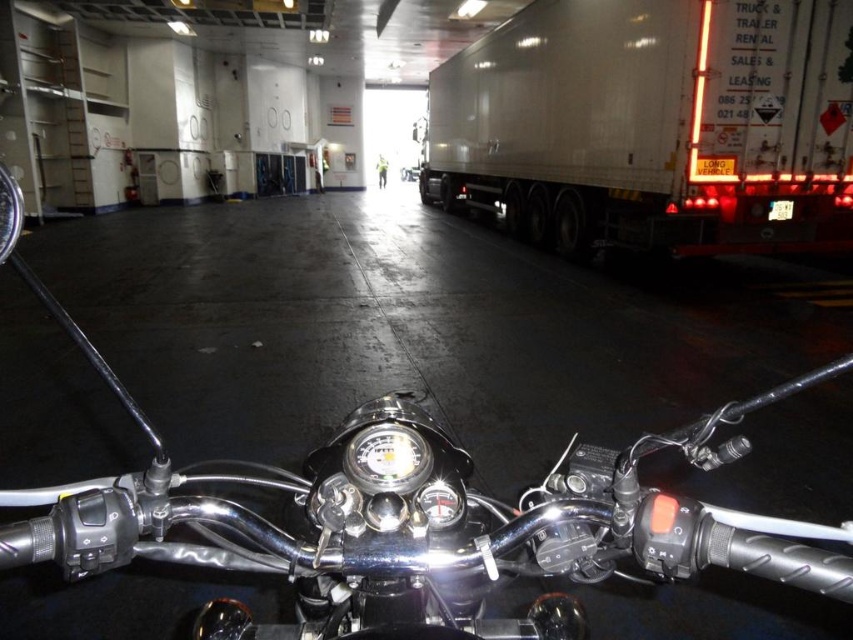
You are riding a motorcycle in a large warehouse and need to check if there is enough space to turn around. The motorcycle has two parts you can see clearly from your position. Which part, the polished chrome motorcycle at center or the metallic silver headlight at center, takes up more space visually?

The polished chrome motorcycle at center is larger in size than the metallic silver headlight at center, so the polished chrome motorcycle at center takes up more space visually.

You are riding a motorcycle and want to park it in a spot that can accommodate both the white glossy trailer truck at right and the metallic silver headlight at center. Given their sizes, which one requires more space for parking?

The white glossy trailer truck at right requires more space for parking since it has a larger size compared to the metallic silver headlight at center.

You are riding a motorcycle and want to pass between the white glossy trailer truck at right and the metallic silver headlight at center. Which one is closer to you so you can plan your path?

The white glossy trailer truck at right is closer to you than the metallic silver headlight at center, so you should plan your path around it first.